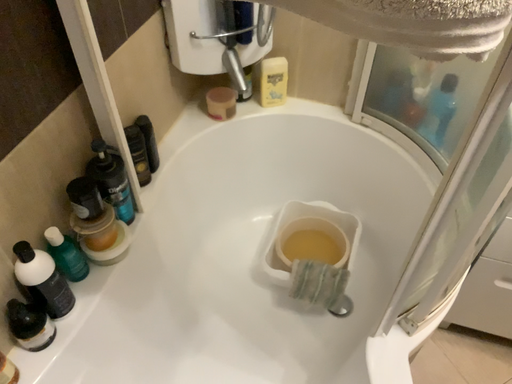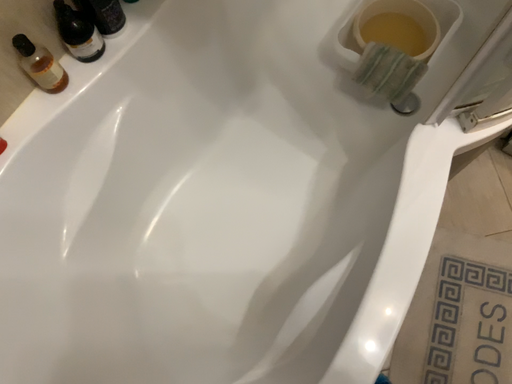
Question: How did the camera likely rotate when shooting the video?

Choices:
 (A) rotated left
 (B) rotated right

Answer: (A)